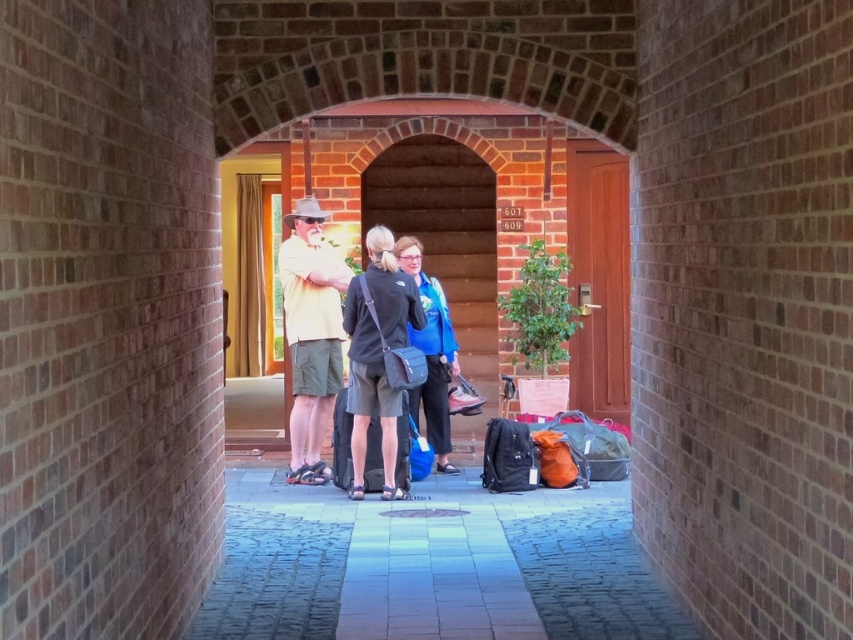
You are standing outside the hotel entrance and see the light yellow cotton shirt at center and the black fabric backpack at center. Which one is higher up?

The light yellow cotton shirt at center is located above the black fabric backpack at center, so the light yellow cotton shirt at center is higher up.

You are standing in front of the arched brick doorway and see the light yellow cotton shirt at center and the black fabric backpack at center. Which object is taller?

The light yellow cotton shirt at center is taller than the black fabric backpack at center.

You are standing at the entrance of the hotel and see two points marked in the scene. Which point is closer to you, the point at coordinates point (316,320) or point (419,243)?

Point (316,320) is in front of point (419,243), so it is closer to you.